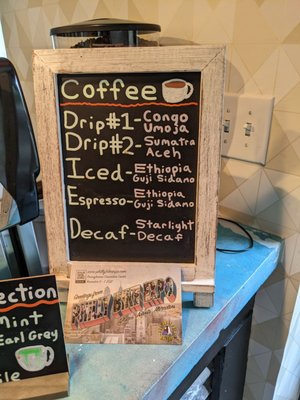
Locate an element on the screen. The image size is (300, 400). illustrated cup of tea is located at coordinates (39, 360).